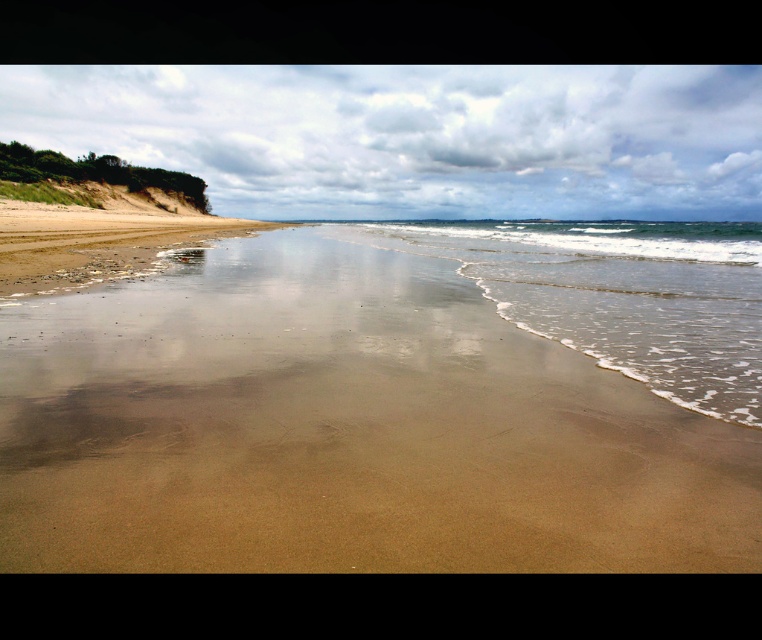
Question: Does smooth sand at center appear on the right side of clear water at lower center?

Choices:
 (A) yes
 (B) no

Answer: (B)

Question: Does smooth sand at center appear on the left side of clear water at lower center?

Choices:
 (A) yes
 (B) no

Answer: (A)

Question: Based on their relative distances, which object is farther from the brown sandy beach at left?

Choices:
 (A) clear water at lower center
 (B) smooth sand at center

Answer: (A)

Question: Can you confirm if smooth sand at center is thinner than clear water at lower center?

Choices:
 (A) no
 (B) yes

Answer: (B)

Question: Which object is the farthest from the brown sandy beach at left?

Choices:
 (A) clear water at lower center
 (B) smooth sand at center

Answer: (A)

Question: Which point appears farthest from the camera in this image?

Choices:
 (A) (87, 476)
 (B) (149, 244)

Answer: (B)